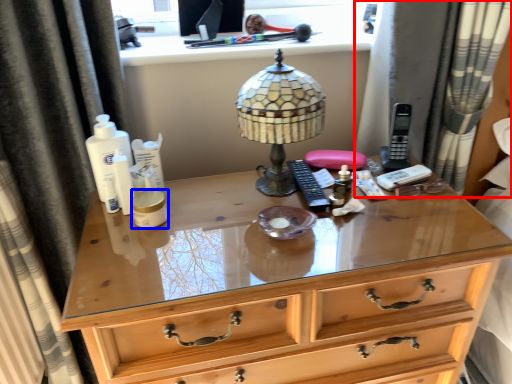
Question: Which point is further to the camera, curtain (highlighted by a red box) or toiletry (highlighted by a blue box)?

Choices:
 (A) curtain
 (B) toiletry

Answer: (A)